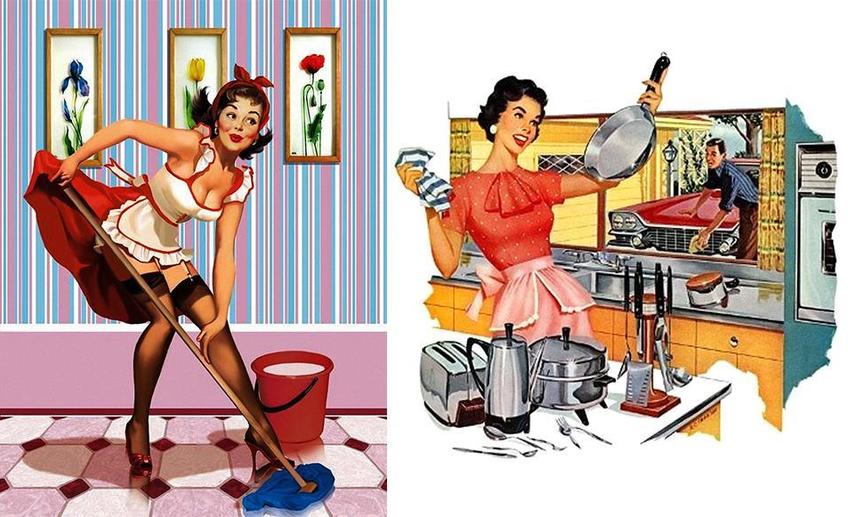
You are a GUI agent. You are given a task and a screenshot of the screen. Output one action in this format:
    pyautogui.click(x=<x>, y=<y>)
    Task: Click on the saucepan
    Image resolution: width=848 pixels, height=517 pixels.
    Given the screenshot: What is the action you would take?
    pyautogui.click(x=626, y=144)